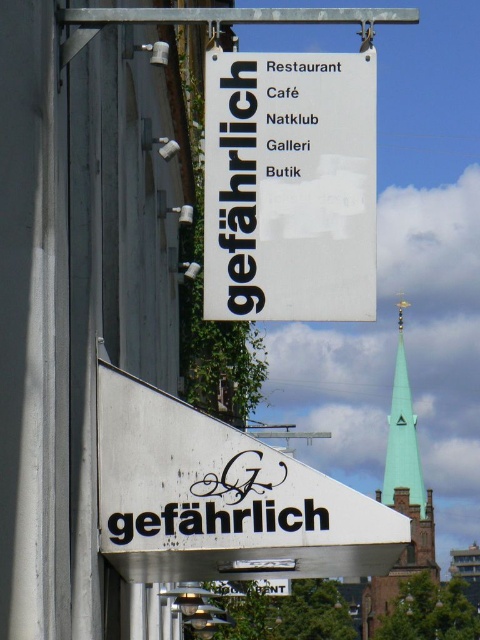
Question: Among these points, which one is nearest to the camera?

Choices:
 (A) (404, 408)
 (B) (175, 426)

Answer: (B)

Question: Which object is positioned closest to the black matte sign at center?

Choices:
 (A) green glass spire at upper center
 (B) green glass spire at right
 (C) white matte sign at center

Answer: (C)

Question: Is black matte sign at center wider than green glass spire at upper center?

Choices:
 (A) no
 (B) yes

Answer: (A)

Question: Can you confirm if white matte sign at center is smaller than green glass spire at upper center?

Choices:
 (A) yes
 (B) no

Answer: (A)

Question: Based on their relative distances, which object is farther from the green glass spire at right?

Choices:
 (A) green glass spire at upper center
 (B) white matte sign at center

Answer: (B)

Question: Is black matte sign at center to the left of green glass spire at upper center from the viewer's perspective?

Choices:
 (A) yes
 (B) no

Answer: (A)